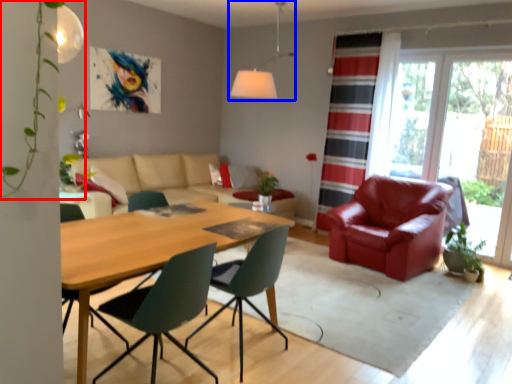
Question: Which object appears closest to the camera in this image, plant (highlighted by a red box) or light fixture (highlighted by a blue box)?

Choices:
 (A) plant
 (B) light fixture

Answer: (A)